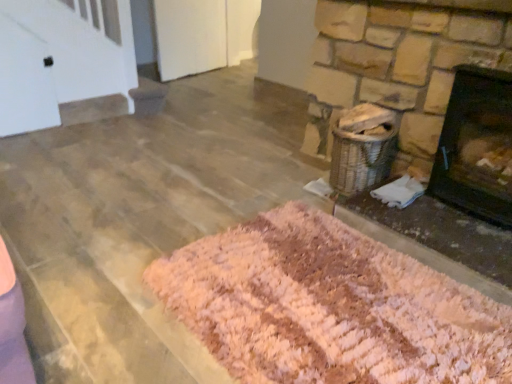
Question: From the image's perspective, would you say black matte fireplace at right is shown under pink shag rug at lower right?

Choices:
 (A) yes
 (B) no

Answer: (B)

Question: Does black matte fireplace at right turn towards pink shag rug at lower right?

Choices:
 (A) yes
 (B) no

Answer: (B)

Question: Is black matte fireplace at right at the left side of pink shag rug at lower right?

Choices:
 (A) yes
 (B) no

Answer: (B)

Question: Can you confirm if black matte fireplace at right is bigger than pink shag rug at lower right?

Choices:
 (A) no
 (B) yes

Answer: (B)

Question: Are black matte fireplace at right and pink shag rug at lower right far apart?

Choices:
 (A) no
 (B) yes

Answer: (A)

Question: Considering their positions, is pink shaggy rug at lower center located in front of or behind pink shag rug at lower right?

Choices:
 (A) front
 (B) behind

Answer: (A)

Question: Choose the correct answer: Is pink shaggy rug at lower center inside pink shag rug at lower right or outside it?

Choices:
 (A) inside
 (B) outside

Answer: (B)

Question: From the image's perspective, is pink shaggy rug at lower center located above or below pink shag rug at lower right?

Choices:
 (A) below
 (B) above

Answer: (A)

Question: Considering the relative positions of pink shaggy rug at lower center and pink shag rug at lower right in the image provided, is pink shaggy rug at lower center to the left or to the right of pink shag rug at lower right?

Choices:
 (A) left
 (B) right

Answer: (A)

Question: Is point (470, 195) closer or farther from the camera than point (338, 301)?

Choices:
 (A) farther
 (B) closer

Answer: (A)

Question: Based on their sizes in the image, would you say black matte fireplace at right is bigger or smaller than pink shaggy rug at lower center?

Choices:
 (A) big
 (B) small

Answer: (B)

Question: In the image, is black matte fireplace at right positioned in front of or behind pink shaggy rug at lower center?

Choices:
 (A) front
 (B) behind

Answer: (B)

Question: From the image's perspective, is black matte fireplace at right positioned above or below pink shaggy rug at lower center?

Choices:
 (A) above
 (B) below

Answer: (A)

Question: Is point (453, 226) closer or farther from the camera than point (467, 72)?

Choices:
 (A) farther
 (B) closer

Answer: (A)

Question: Considering their positions, is pink shag rug at lower right located in front of or behind black matte fireplace at right?

Choices:
 (A) behind
 (B) front

Answer: (B)